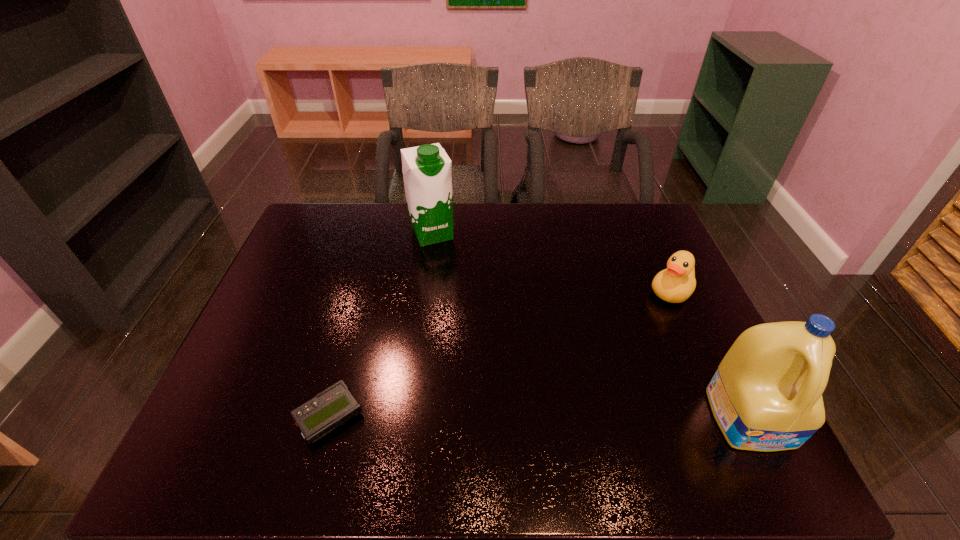
Where is `vacant area that lies between the second shortest object and the detergent`? The height and width of the screenshot is (540, 960). vacant area that lies between the second shortest object and the detergent is located at coordinates (711, 355).

Where is `blank region between the second farthest object and the soya milk`? This screenshot has width=960, height=540. blank region between the second farthest object and the soya milk is located at coordinates (552, 262).

Image resolution: width=960 pixels, height=540 pixels. Identify the location of empty space between the beeper and the second shortest object. (500, 354).

Locate an element on the screen. The image size is (960, 540). vacant space that's between the beeper and the detergent is located at coordinates click(540, 417).

This screenshot has width=960, height=540. Find the location of `free space between the duck and the soya milk`. free space between the duck and the soya milk is located at coordinates (552, 262).

Locate an element on the screen. unoccupied position between the farthest object and the beeper is located at coordinates pos(381,325).

Identify the location of vacant space that is in between the shortest object and the soya milk. [x=381, y=325].

Locate an element on the screen. object that can be found as the second closest to the leftmost object is located at coordinates (766, 395).

Identify which object is the closest to the shortest object. Please provide its 2D coordinates. Your answer should be formatted as a tuple, i.e. [(x, y)], where the tuple contains the x and y coordinates of a point satisfying the conditions above.

[(427, 174)]

Image resolution: width=960 pixels, height=540 pixels. What are the coordinates of `vacant position in the image that satisfies the following two spatial constraints: 1. on the back side of the beeper; 2. on the right side of the third nearest object` in the screenshot? It's located at (364, 292).